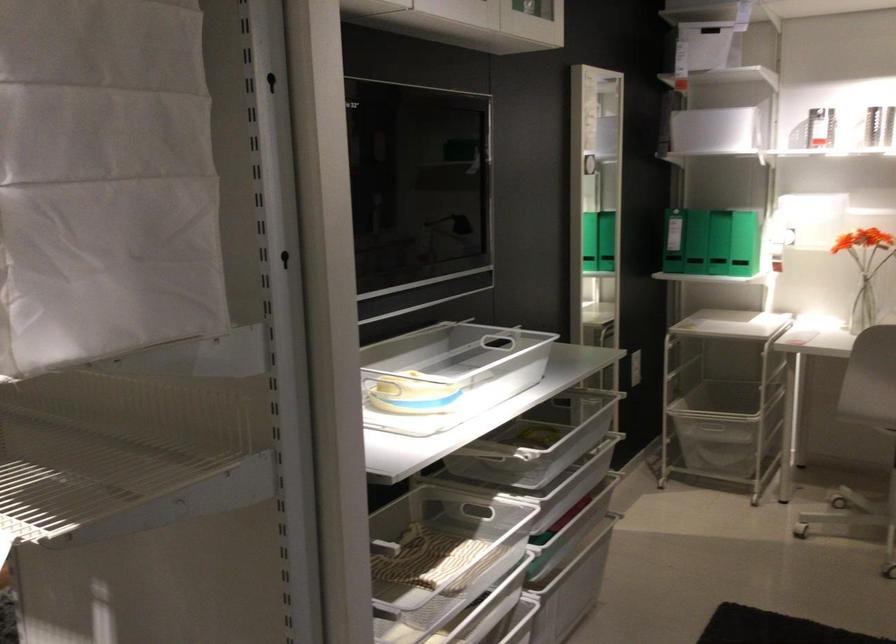
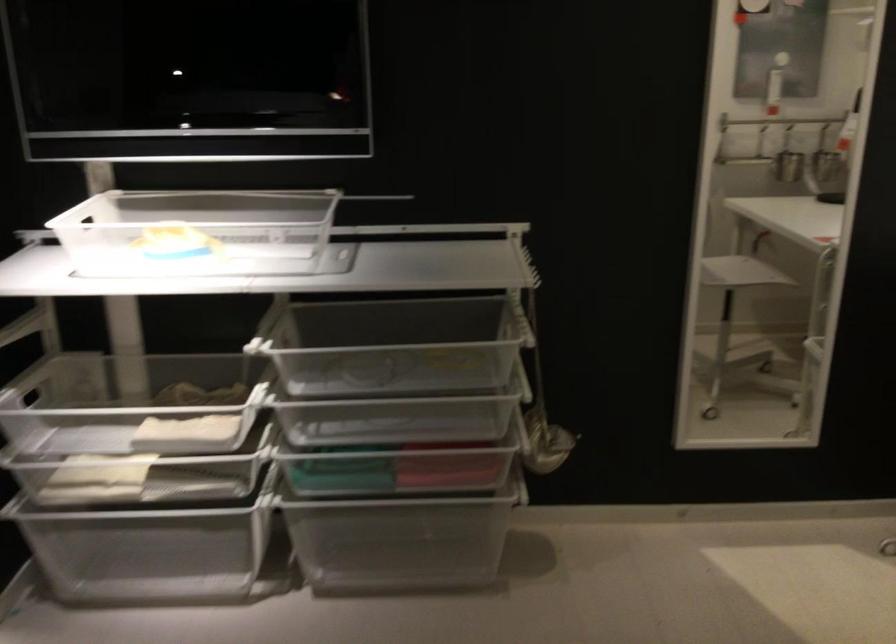
The point at [521,462] is marked in the first image. Where is the corresponding point in the second image?

(397, 406)